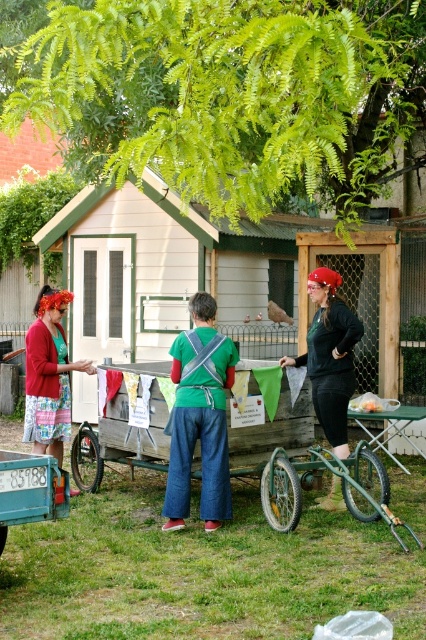
Is green denim pants at center behind matte black shirt at center?

No, green denim pants at center is in front of matte black shirt at center.

Between green denim pants at center and matte black shirt at center, which one is positioned higher?

Positioned higher is matte black shirt at center.

From the picture: Who is more forward, [170,460] or [336,352]?

Point [170,460] is in front.

The height and width of the screenshot is (640, 426). Find the location of `green denim pants at center`. green denim pants at center is located at coordinates (199, 417).

Between point (221, 500) and point (63, 300), which one is positioned behind?

Positioned behind is point (63, 300).

Can you confirm if green denim pants at center is positioned above floral-patterned fabric dress at left?

Actually, green denim pants at center is below floral-patterned fabric dress at left.

Who is more distant from viewer, [207,426] or [48,314]?

The point [48,314] is behind.

At what (x,y) coordinates should I click in order to perform the action: click on green denim pants at center. Please return your answer as a coordinate pair (x, y). The height and width of the screenshot is (640, 426). Looking at the image, I should click on (199, 417).

Does point (354, 324) lie in front of point (57, 428)?

Yes, it is.

Who is taller, matte black shirt at center or floral-patterned fabric dress at left?

floral-patterned fabric dress at left

Image resolution: width=426 pixels, height=640 pixels. What do you see at coordinates (330, 356) in the screenshot?
I see `matte black shirt at center` at bounding box center [330, 356].

You are a GUI agent. You are given a task and a screenshot of the screen. Output one action in this format:
    pyautogui.click(x=<x>, y=<y>)
    Task: Click on the matte black shirt at center
    The height and width of the screenshot is (640, 426).
    Given the screenshot: What is the action you would take?
    pyautogui.click(x=330, y=356)